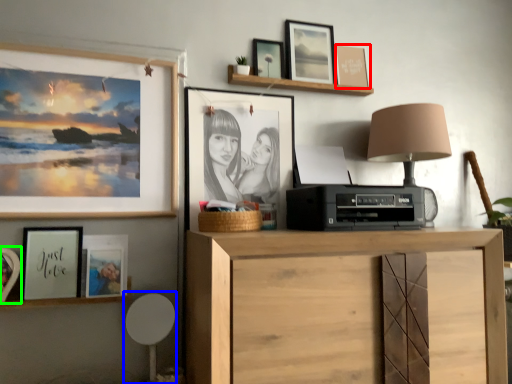
Question: Based on their relative distances, which object is nearer to picture frame (highlighted by a red box)? Choose from swivel chair (highlighted by a blue box) and picture frame (highlighted by a green box).

Choices:
 (A) swivel chair
 (B) picture frame

Answer: (A)